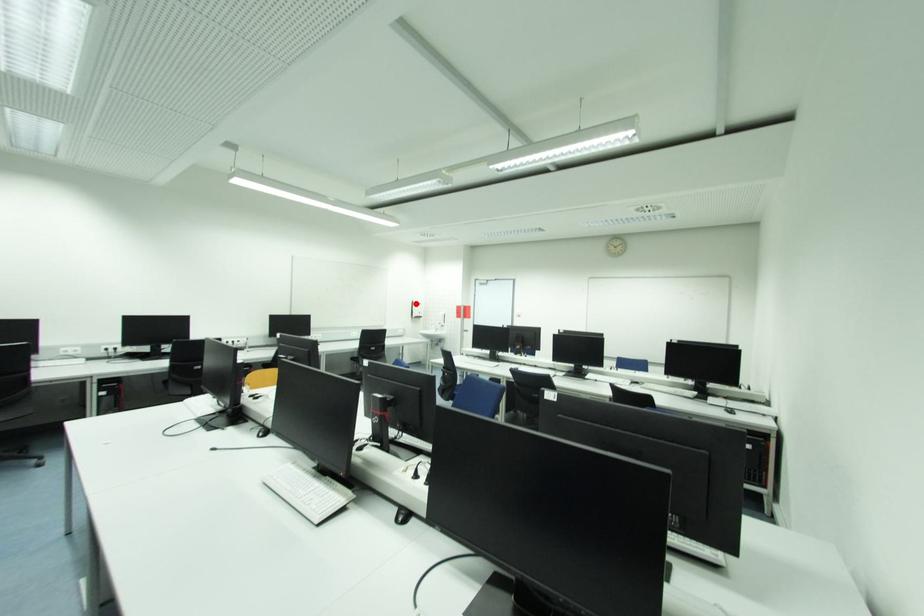
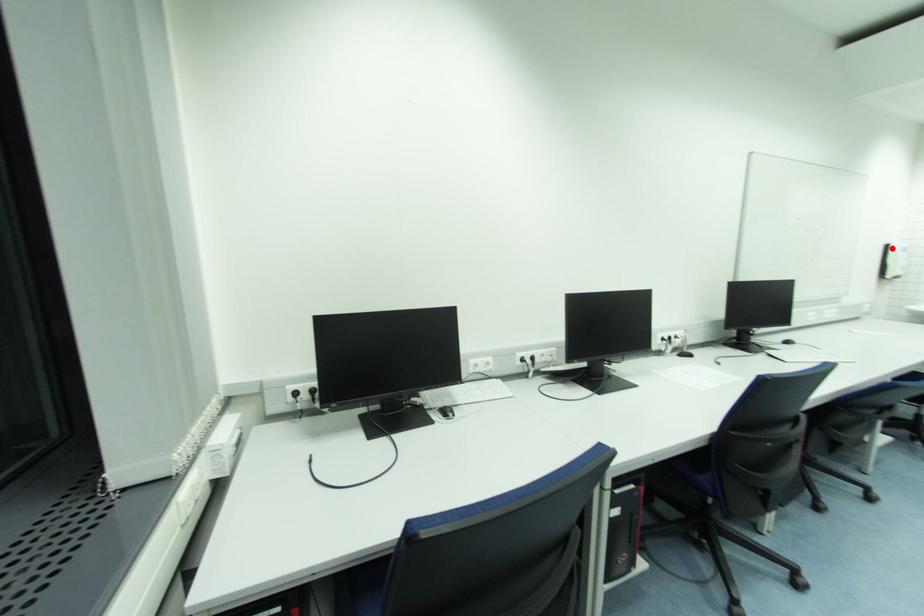
I am providing you with two images of the same scene from different viewpoints. A red point is marked on the first image and another point is marked on the second image. Is the red point in image1 aligned with the point shown in image2?

Yes